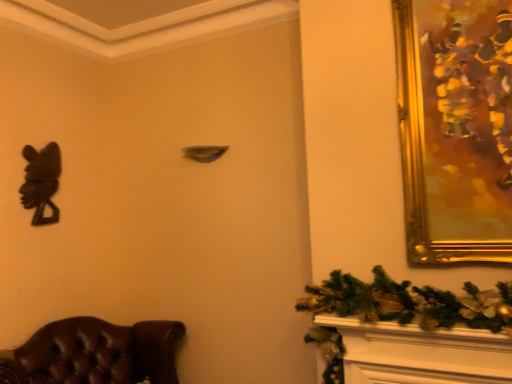
Question: From a real-world perspective, is gold/gilded picture frame at upper right below black matte sculpture at left?

Choices:
 (A) no
 (B) yes

Answer: (A)

Question: Can you confirm if gold/gilded picture frame at upper right is smaller than black matte sculpture at left?

Choices:
 (A) no
 (B) yes

Answer: (A)

Question: Does gold/gilded picture frame at upper right have a larger size compared to black matte sculpture at left?

Choices:
 (A) yes
 (B) no

Answer: (A)

Question: Is gold/gilded picture frame at upper right wider than black matte sculpture at left?

Choices:
 (A) yes
 (B) no

Answer: (A)

Question: Can you confirm if gold/gilded picture frame at upper right is shorter than black matte sculpture at left?

Choices:
 (A) no
 (B) yes

Answer: (A)

Question: In terms of size, does black matte sculpture at left appear bigger or smaller than brown leather chair at lower left?

Choices:
 (A) big
 (B) small

Answer: (B)

Question: In terms of height, does black matte sculpture at left look taller or shorter compared to brown leather chair at lower left?

Choices:
 (A) short
 (B) tall

Answer: (B)

Question: In the image, is black matte sculpture at left on the left side or the right side of brown leather chair at lower left?

Choices:
 (A) right
 (B) left

Answer: (B)

Question: From the image's perspective, is black matte sculpture at left positioned above or below brown leather chair at lower left?

Choices:
 (A) above
 (B) below

Answer: (A)

Question: Is point (44, 187) positioned closer to the camera than point (424, 173)?

Choices:
 (A) farther
 (B) closer

Answer: (A)

Question: From a real-world perspective, relative to gold/gilded picture frame at upper right, is black matte sculpture at left vertically above or below?

Choices:
 (A) below
 (B) above

Answer: (A)

Question: In terms of height, does black matte sculpture at left look taller or shorter compared to gold/gilded picture frame at upper right?

Choices:
 (A) tall
 (B) short

Answer: (B)

Question: Visually, is black matte sculpture at left positioned to the left or to the right of gold/gilded picture frame at upper right?

Choices:
 (A) left
 (B) right

Answer: (A)

Question: Considering the relative positions of brown leather chair at lower left and black matte sculpture at left in the image provided, is brown leather chair at lower left to the left or to the right of black matte sculpture at left?

Choices:
 (A) right
 (B) left

Answer: (A)

Question: Is brown leather chair at lower left spatially inside black matte sculpture at left, or outside of it?

Choices:
 (A) outside
 (B) inside

Answer: (A)